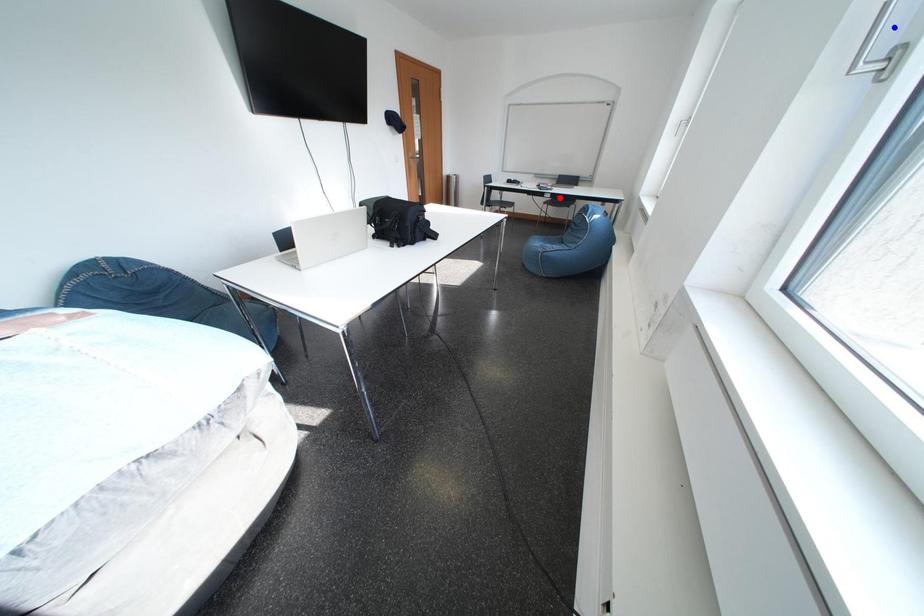
Question: In the image, two points are highlighted. Which point is nearer to the camera? Reply with the corresponding letter.

Choices:
 (A) blue point
 (B) red point

Answer: (A)